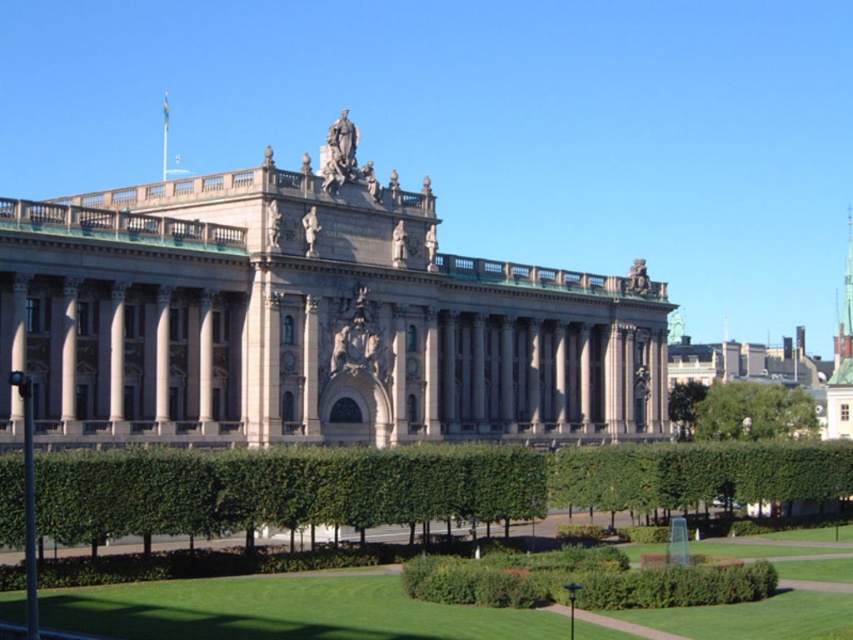
Question: In this image, where is beige stone palace at center located relative to green leafy tree at lower right?

Choices:
 (A) left
 (B) right

Answer: (A)

Question: Which object is farther from the camera taking this photo?

Choices:
 (A) beige stone palace at center
 (B) green leafy tree at lower right

Answer: (B)

Question: Which point is closer to the camera?

Choices:
 (A) beige stone palace at center
 (B) green leafy tree at lower right

Answer: (A)

Question: Among these objects, which one is farthest from the camera?

Choices:
 (A) beige stone palace at center
 (B) green leafy tree at lower right

Answer: (B)

Question: Can you confirm if beige stone palace at center is positioned to the right of green leafy tree at lower right?

Choices:
 (A) no
 (B) yes

Answer: (A)

Question: Does beige stone palace at center have a lesser width compared to green leafy tree at lower right?

Choices:
 (A) yes
 (B) no

Answer: (B)